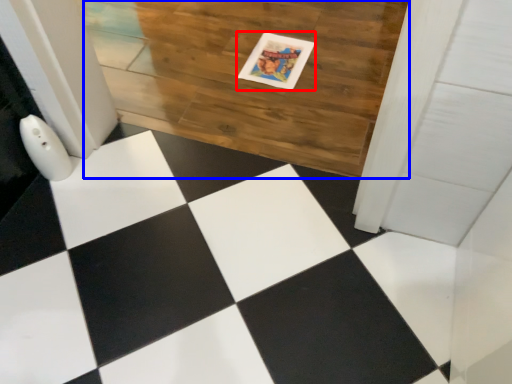
Question: Which of the following is the farthest to the observer, postcard (highlighted by a red box) or hardwood (highlighted by a blue box)?

Choices:
 (A) postcard
 (B) hardwood

Answer: (A)